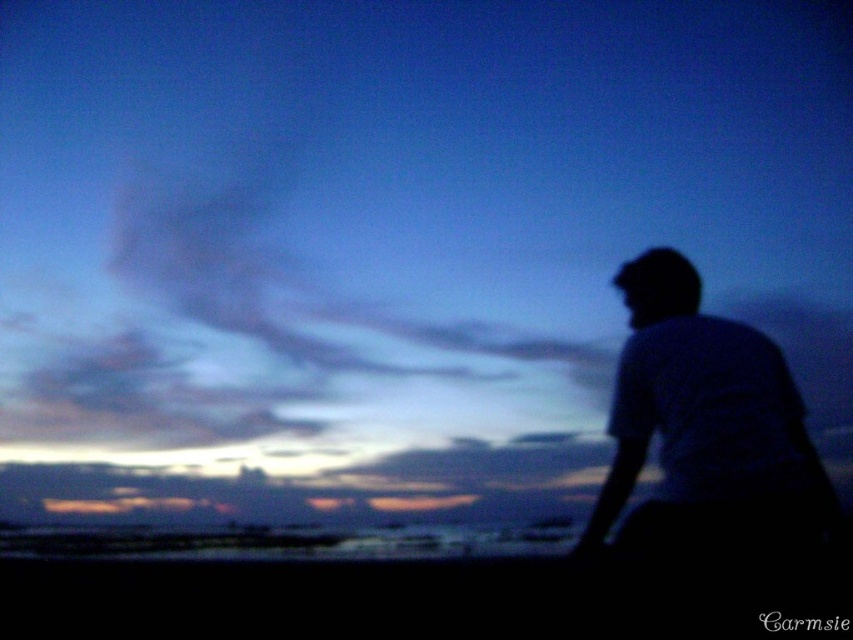
Does dark fabric shirt at right have a larger size compared to black matte head at upper right?

Yes.

Does dark fabric shirt at right appear over black matte head at upper right?

Actually, dark fabric shirt at right is below black matte head at upper right.

The image size is (853, 640). I want to click on dark fabric shirt at right, so click(x=703, y=426).

Where is `dark fabric shirt at right`? dark fabric shirt at right is located at coordinates (703, 426).